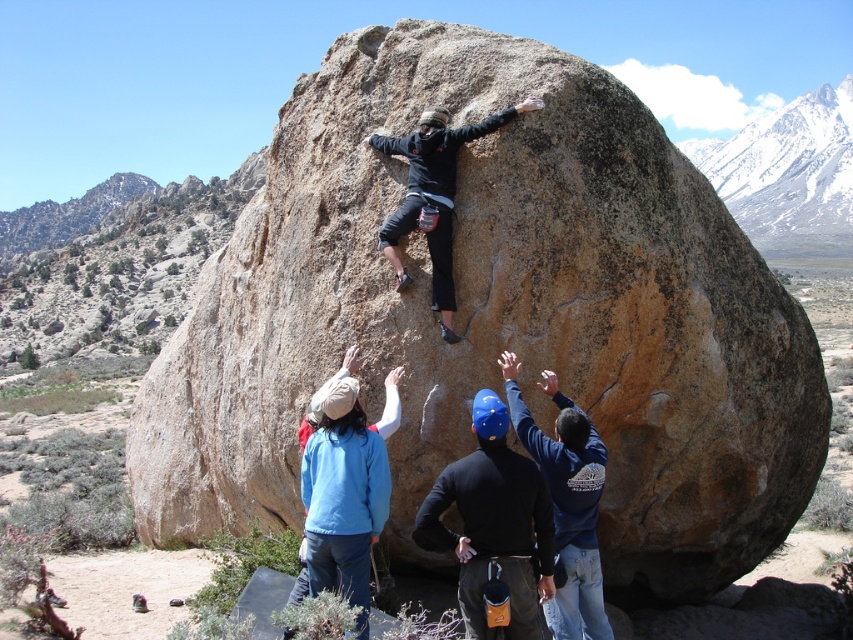
You are a photographer positioned at the base of the large boulder. You want to capture a photo of the climber and the observer wearing the black matte shirt at center. Based on their positions, will the observer in the matte black jacket at center block your view of the climber?

The black matte shirt at center is located below the matte black jacket at center. Since the observer in the matte black jacket at center is above the observer in the black matte shirt at center, the matte black jacket at center will not block your view of the climber who is near the top of the boulder.

You are a drone operator tasked with capturing aerial footage of the climbing scene. Your drone is currently hovering above the blue helmet at upper center. You need to move it to the matte black jacket at center. How far will the drone have to travel to reach its destination?

The distance between the blue helmet at upper center and the matte black jacket at center is 4.13 meters, so the drone will need to travel 4.13 meters to reach the destination.